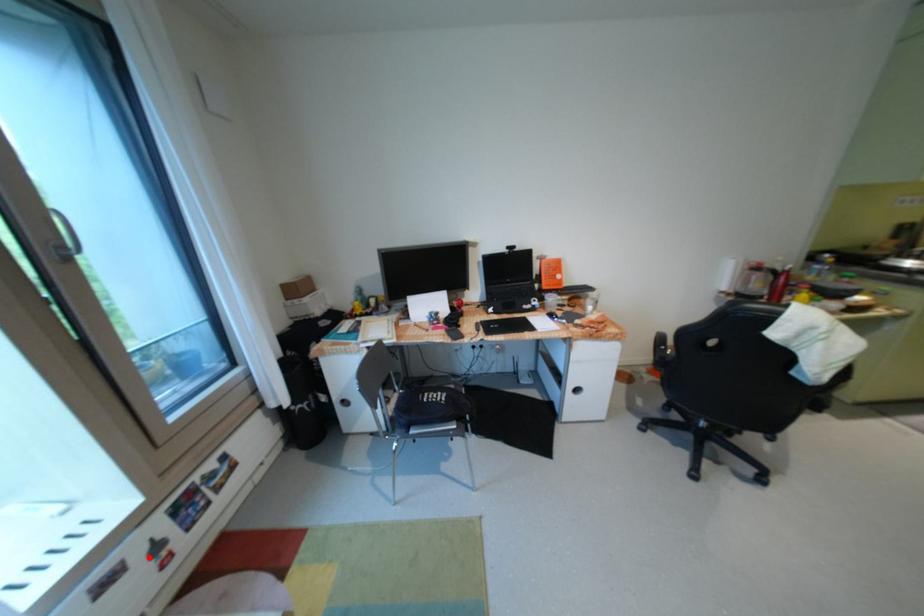
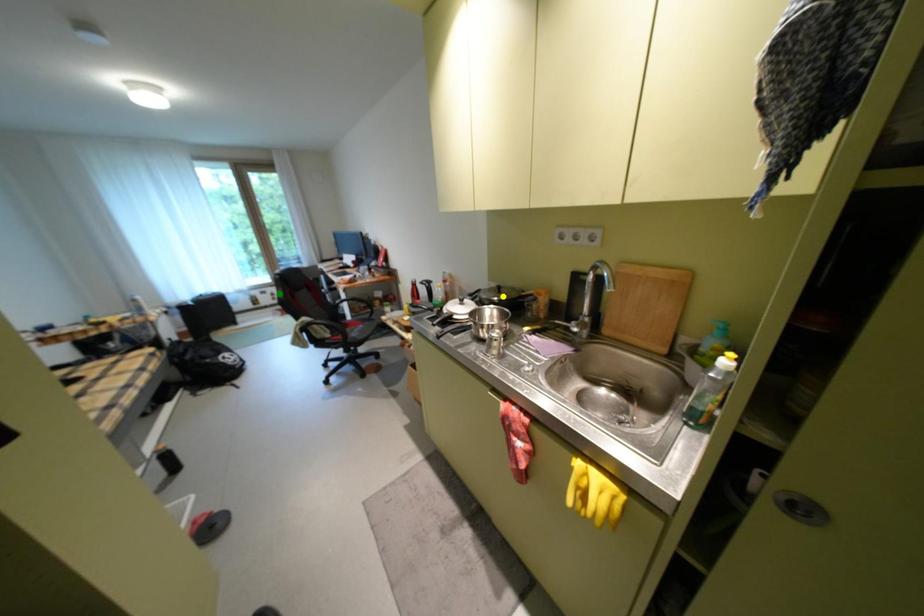
Question: I am providing you with two images of the same scene from different viewpoints. A red point is marked on the first image. You are given multiple points on the second image. Can you choose the point in image 2 that corresponds to the point in image 1?

Choices:
 (A) green point
 (B) blue point
 (C) yellow point

Answer: (A)